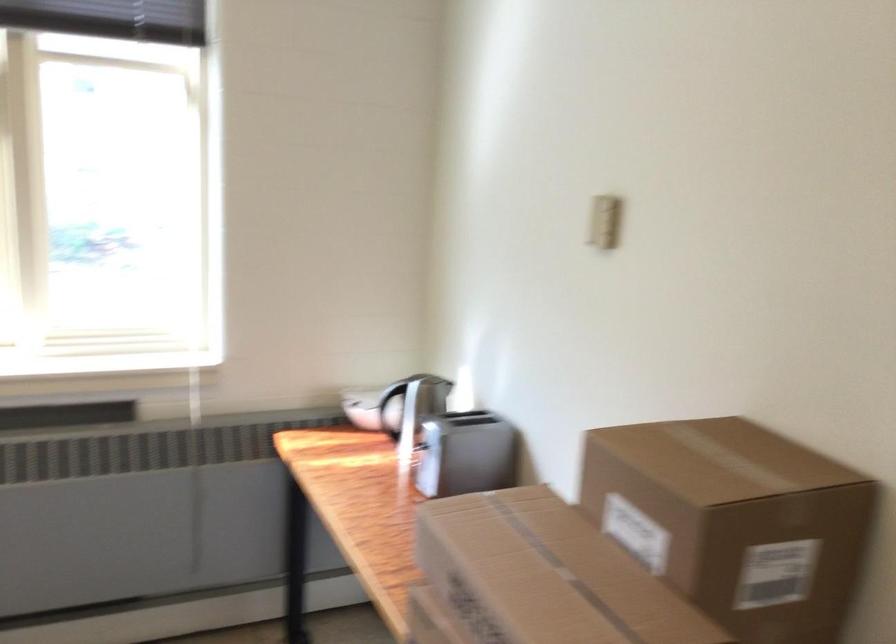
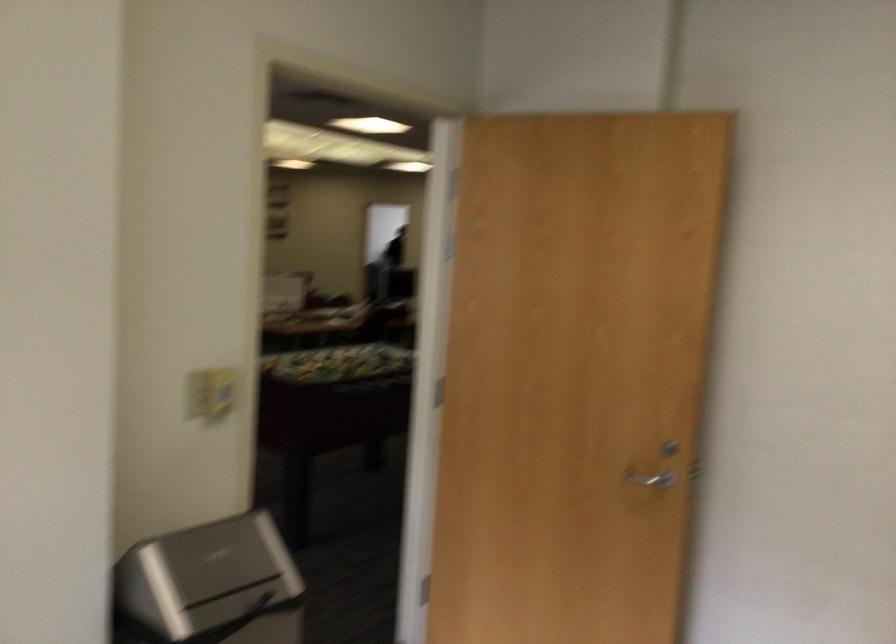
The first image is from the beginning of the video and the second image is from the end. How did the camera likely rotate when shooting the video?

The camera rotated toward right-down.